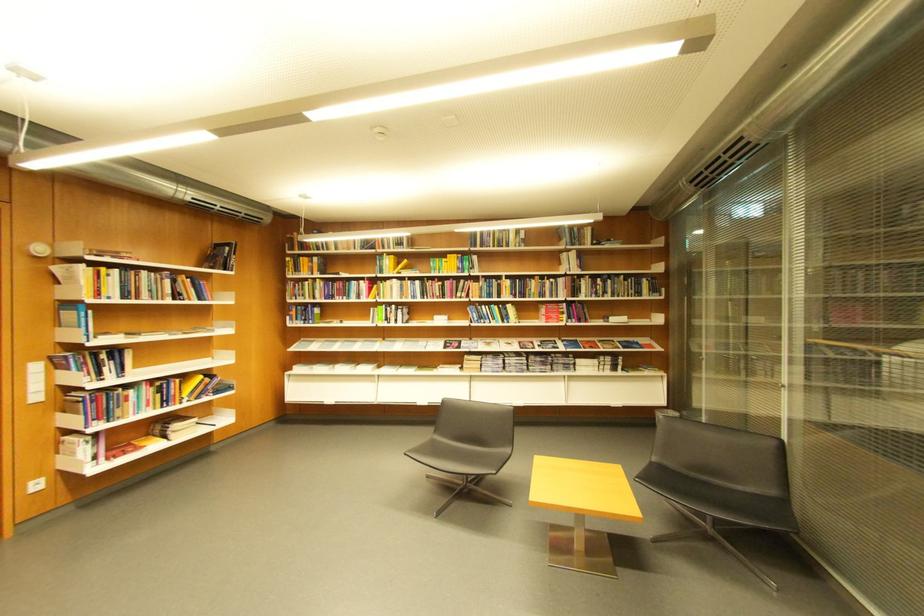
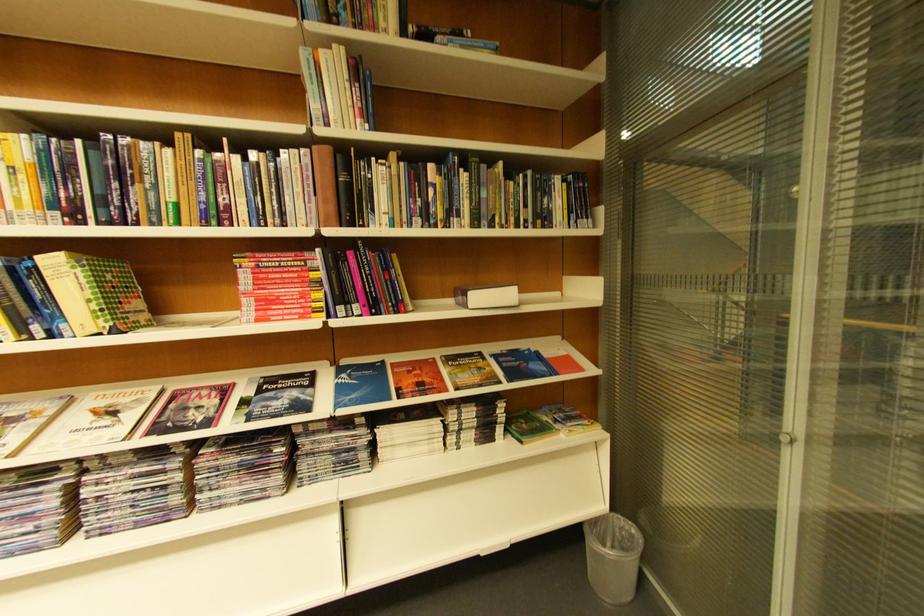
In the second image, find the point that corresponds to [621,323] in the first image.

(480, 309)